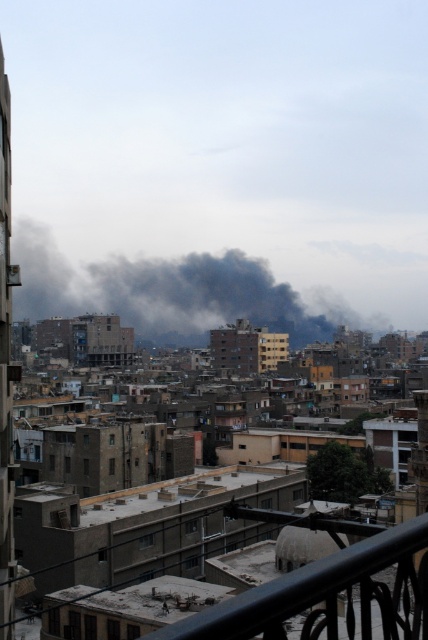
Question: Is black smoke at center positioned in front of black metal railing at lower right?

Choices:
 (A) yes
 (B) no

Answer: (B)

Question: Does black smoke at center lie behind black metal railing at lower right?

Choices:
 (A) yes
 (B) no

Answer: (A)

Question: Which point is farther to the camera?

Choices:
 (A) tap(246, 289)
 (B) tap(389, 545)

Answer: (A)

Question: Which point is farther to the camera?

Choices:
 (A) (270, 326)
 (B) (228, 636)

Answer: (A)

Question: Does black smoke at center have a smaller size compared to black metal railing at lower right?

Choices:
 (A) yes
 (B) no

Answer: (B)